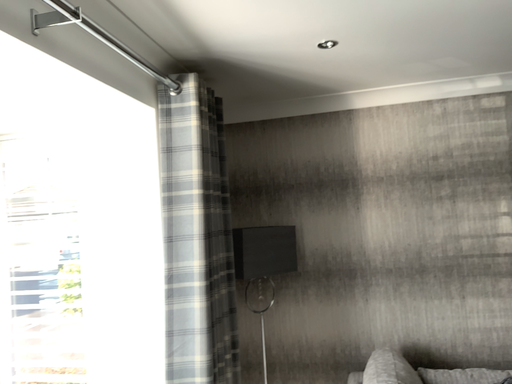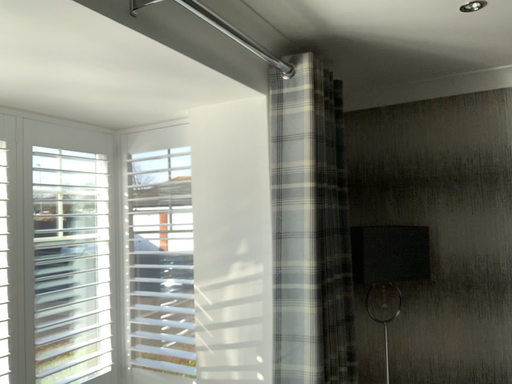
Question: Which way did the camera rotate in the video?

Choices:
 (A) rotated right
 (B) rotated left

Answer: (B)